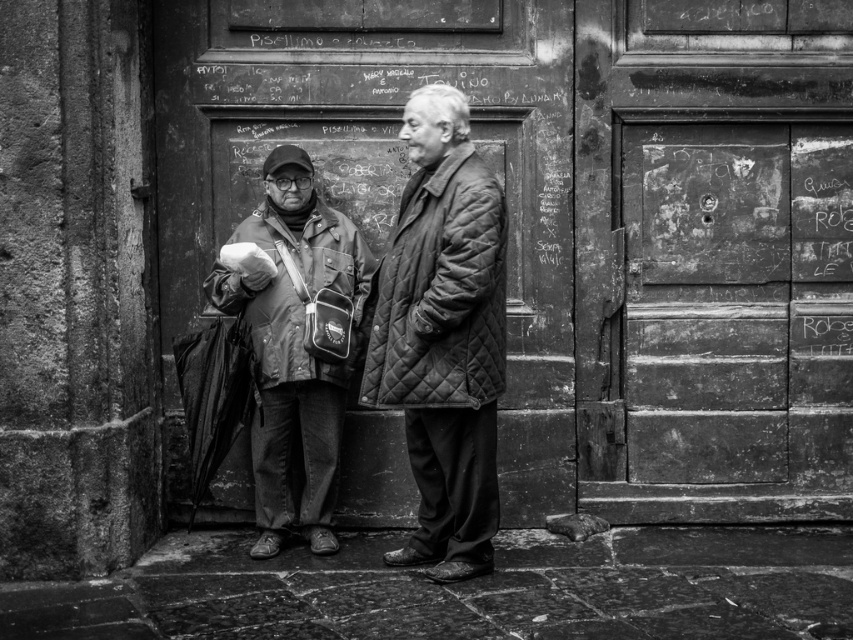
Which is more to the right, quilted leather jacket at center or quilted fabric jacket at center?

From the viewer's perspective, quilted leather jacket at center appears more on the right side.

Between point (496, 467) and point (338, 241), which one is positioned behind?

The point (338, 241) is more distant.

This screenshot has width=853, height=640. I want to click on quilted leather jacket at center, so click(444, 336).

Between quilted fabric coat at center and quilted fabric jacket at center, which one is positioned lower?

quilted fabric jacket at center is lower down.

Can you confirm if quilted fabric coat at center is bigger than quilted fabric jacket at center?

No, quilted fabric coat at center is not bigger than quilted fabric jacket at center.

I want to click on quilted fabric coat at center, so click(x=444, y=336).

I want to click on quilted fabric coat at center, so point(444,336).

Find the location of a particular element. This screenshot has height=640, width=853. quilted leather jacket at center is located at coordinates (444, 336).

How distant is quilted leather jacket at center from quilted fabric coat at center?

quilted leather jacket at center is 0.60 inches from quilted fabric coat at center.

Between point (415, 248) and point (399, 140), which one is positioned behind?

Point (399, 140)

Where is `quilted leather jacket at center`? Image resolution: width=853 pixels, height=640 pixels. quilted leather jacket at center is located at coordinates (444, 336).